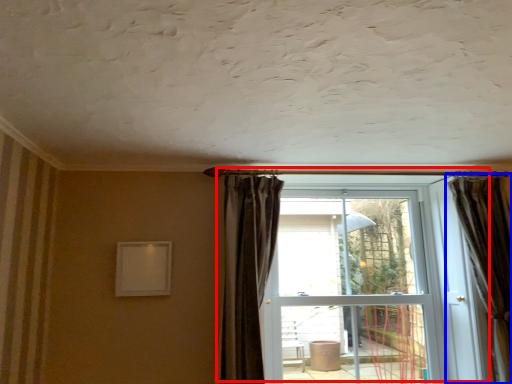
Question: Among these objects, which one is farthest to the camera, door (highlighted by a red box) or curtain (highlighted by a blue box)?

Choices:
 (A) door
 (B) curtain

Answer: (A)